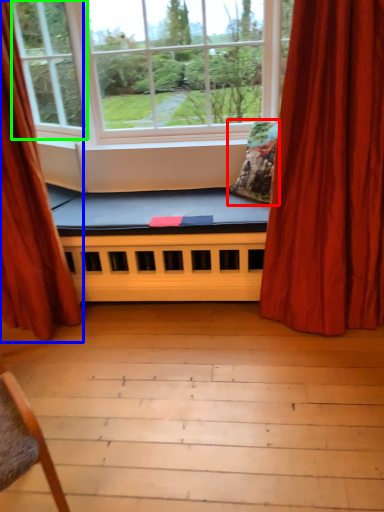
Question: Which object is the farthest from pillow (highlighted by a red box)? Choose among these: curtain (highlighted by a blue box) or window (highlighted by a green box).

Choices:
 (A) curtain
 (B) window

Answer: (B)